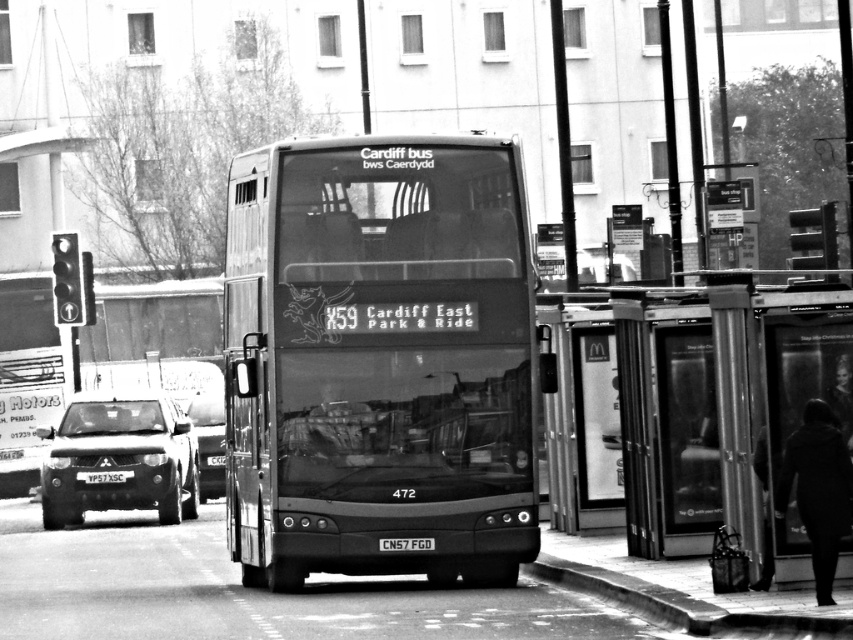
Question: Estimate the real-world distances between objects in this image. Which object is farther from the metallic silver bus at center?

Choices:
 (A) smooth concrete curb at lower center
 (B) black metal license plate at center

Answer: (A)

Question: Can you confirm if metallic silver bus at center is bigger than transparent glass bus stop at right?

Choices:
 (A) no
 (B) yes

Answer: (B)

Question: Does metallic silver bus at center come in front of black metal license plate at center?

Choices:
 (A) no
 (B) yes

Answer: (B)

Question: Which point is farther to the camera?

Choices:
 (A) transparent glass bus stop at right
 (B) smooth concrete curb at lower center

Answer: (A)

Question: Estimate the real-world distances between objects in this image. Which object is farther from the metallic silver bus at center?

Choices:
 (A) black metal license plate at center
 (B) transparent glass bus stop at right

Answer: (B)

Question: Is shiny black suv at left closer to the viewer compared to smooth concrete curb at lower center?

Choices:
 (A) no
 (B) yes

Answer: (A)